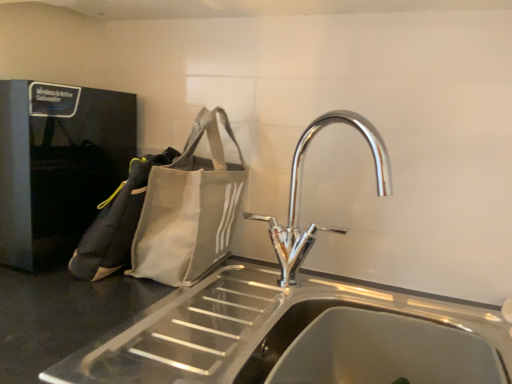
Question: Do you think stainless steel sink at center is within gray fabric tote bag at left, which is the first pouch from right to left, or outside of it?

Choices:
 (A) inside
 (B) outside

Answer: (B)

Question: From a real-world perspective, is stainless steel sink at center physically located above or below gray fabric tote bag at left, which is the first pouch from right to left?

Choices:
 (A) above
 (B) below

Answer: (B)

Question: Based on their relative distances, which object is nearer to the white canvas tote bag at left, which is the 1th pouch in left-to-right order?

Choices:
 (A) chrome metallic tap at center
 (B) gray fabric tote bag at left, which is the first pouch from right to left
 (C) stainless steel sink at center

Answer: (B)

Question: Considering the real-world distances, which object is closest to the stainless steel sink at center?

Choices:
 (A) chrome metallic tap at center
 (B) white canvas tote bag at left, which is the 1th pouch in left-to-right order
 (C) gray fabric tote bag at left, which is the 2th pouch from left to right

Answer: (A)